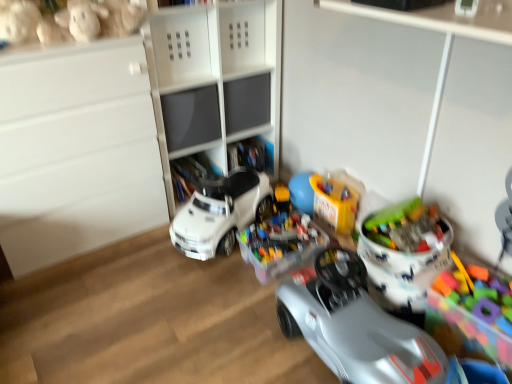
Question: Would you say multicolored plastic blocks at right, the seventh toy in the left-to-right sequence, is outside shiny plastic toy car at center?

Choices:
 (A) yes
 (B) no

Answer: (A)

Question: Would you say shiny plastic toy car at center is part of multicolored plastic blocks at right, which is counted as the 1th toy, starting from the right,'s contents?

Choices:
 (A) no
 (B) yes

Answer: (A)

Question: From a real-world perspective, is multicolored plastic blocks at right, which is counted as the 1th toy, starting from the right, beneath shiny plastic toy car at center?

Choices:
 (A) no
 (B) yes

Answer: (B)

Question: Can you confirm if multicolored plastic blocks at right, the seventh toy in the left-to-right sequence, is bigger than shiny plastic toy car at center?

Choices:
 (A) no
 (B) yes

Answer: (A)

Question: From a real-world perspective, is multicolored plastic blocks at right, the seventh toy in the left-to-right sequence, positioned over shiny plastic toy car at center based on gravity?

Choices:
 (A) yes
 (B) no

Answer: (B)

Question: Does point (89, 13) appear closer or farther from the camera than point (301, 246)?

Choices:
 (A) closer
 (B) farther

Answer: (A)

Question: In terms of size, does fluffy beige teddy bear at upper left, the 2th toy viewed from the left, appear bigger or smaller than translucent plastic container at center, which is the fourth toy from left to right?

Choices:
 (A) big
 (B) small

Answer: (B)

Question: Is fluffy beige teddy bear at upper left, the 2th toy viewed from the left, taller or shorter than translucent plastic container at center, acting as the 4th toy starting from the right?

Choices:
 (A) short
 (B) tall

Answer: (A)

Question: Considering the relative positions of fluffy beige teddy bear at upper left, acting as the 6th toy starting from the right, and translucent plastic container at center, which is the fourth toy from left to right, in the image provided, is fluffy beige teddy bear at upper left, acting as the 6th toy starting from the right, to the left or to the right of translucent plastic container at center, which is the fourth toy from left to right,?

Choices:
 (A) right
 (B) left

Answer: (B)

Question: Is shiny plastic toy car at center to the left or to the right of fluffy beige teddy bear at upper left, the first toy when ordered from left to right, in the image?

Choices:
 (A) left
 (B) right

Answer: (B)

Question: Is shiny plastic toy car at center inside or outside of fluffy beige teddy bear at upper left, the first toy when ordered from left to right?

Choices:
 (A) inside
 (B) outside

Answer: (B)

Question: Is shiny plastic toy car at center in front of or behind fluffy beige teddy bear at upper left, the first toy when ordered from left to right, in the image?

Choices:
 (A) behind
 (B) front

Answer: (B)

Question: From the image's perspective, is shiny plastic toy car at center above or below fluffy beige teddy bear at upper left, the first toy when ordered from left to right?

Choices:
 (A) below
 (B) above

Answer: (A)

Question: Is translucent plastic toy at center right, acting as the 6th toy starting from the left, inside the boundaries of white matte cabinet at upper center, positioned as the 2th shelf in bottom-to-top order, or outside?

Choices:
 (A) outside
 (B) inside

Answer: (A)

Question: Considering the positions of translucent plastic toy at center right, acting as the 6th toy starting from the left, and white matte cabinet at upper center, which appears as the 1th shelf when viewed from the top, in the image, is translucent plastic toy at center right, acting as the 6th toy starting from the left, wider or thinner than white matte cabinet at upper center, which appears as the 1th shelf when viewed from the top,?

Choices:
 (A) wide
 (B) thin

Answer: (B)